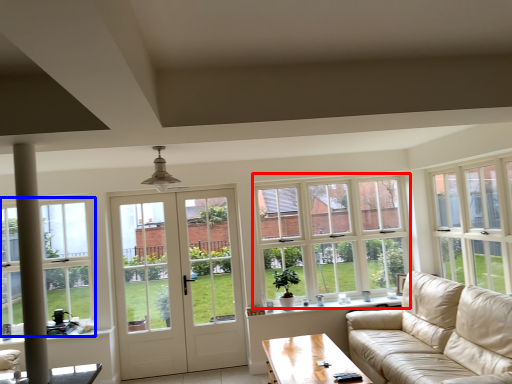
Question: Among these objects, which one is nearest to the camera, window (highlighted by a red box) or window (highlighted by a blue box)?

Choices:
 (A) window
 (B) window

Answer: (B)